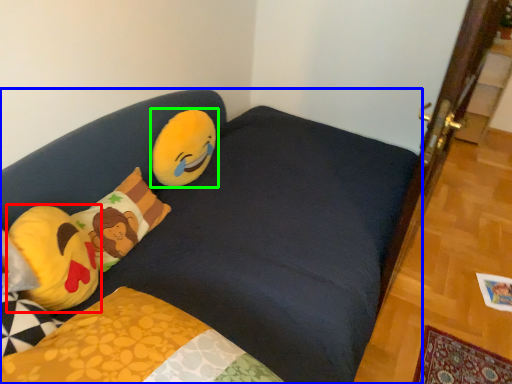
Question: Estimate the real-world distances between objects in this image. Which object is closer to pillow (highlighted by a red box), studio couch (highlighted by a blue box) or toy (highlighted by a green box)?

Choices:
 (A) studio couch
 (B) toy

Answer: (A)